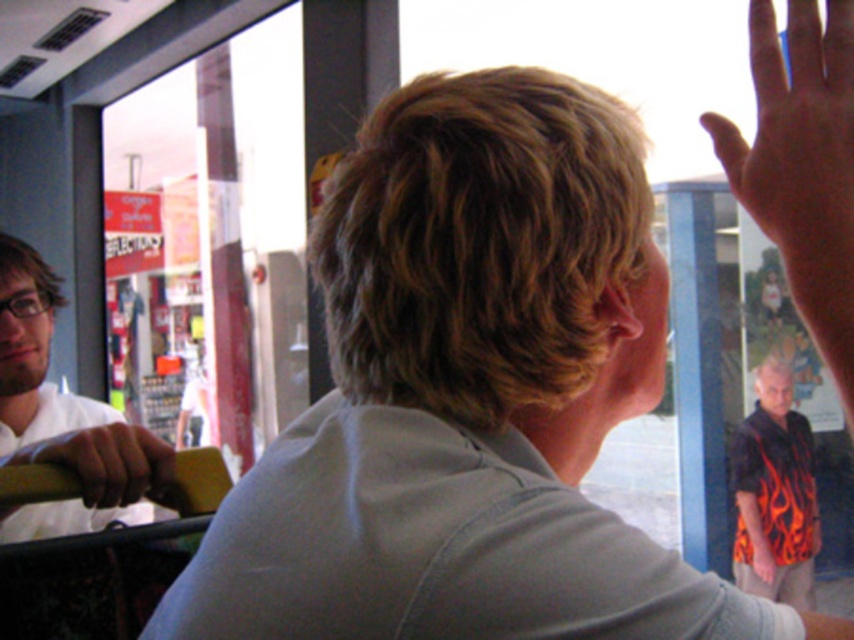
You are a passenger on a bus and want to locate the white matte shirt at left. According to the coordinates provided, where should you look relative to the bus window?

The white matte shirt at left is located at coordinates point (62, 417), which means it is positioned approximately 65.2 percent from the left edge and 7.4 percent from the top edge of the image. To locate it relative to the bus window, you should look towards the left side of the window, closer to the lower portion since the y coordinate is near the bottom.

You are standing inside the public transportation vehicle and want to reach the two points marked in the image. Which point, point (757, 148) or point (137, 500), is closer to you?

Point (757, 148) is closer to the viewer than point (137, 500).